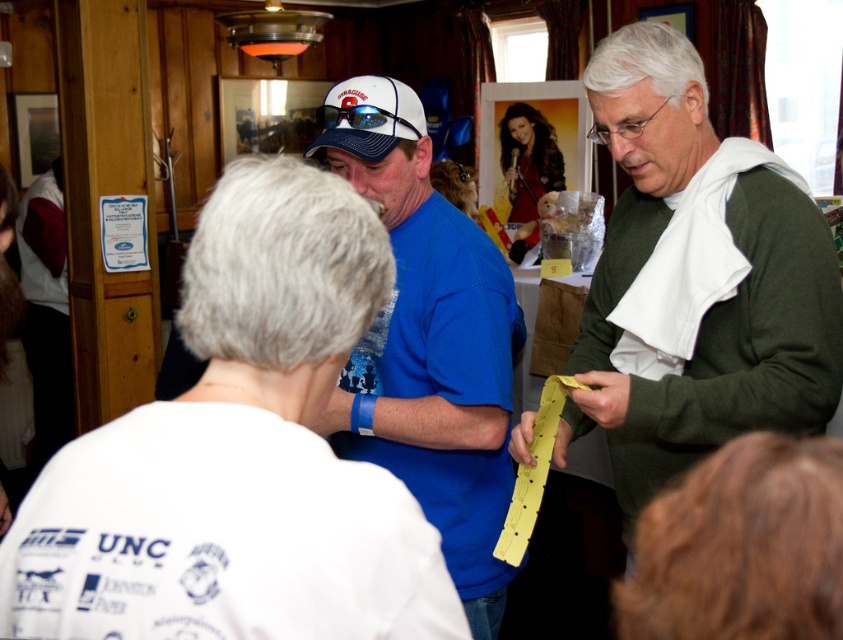
Looking at this image, who is more forward, (470, 240) or (548, 188)?

Point (470, 240) is in front.

Is blue fabric shirt at center above shiny brown hair at upper center?

No, blue fabric shirt at center is not above shiny brown hair at upper center.

Does point (374, 380) come in front of point (538, 189)?

Yes, point (374, 380) is closer to viewer.

You are a GUI agent. You are given a task and a screenshot of the screen. Output one action in this format:
    pyautogui.click(x=<x>, y=<y>)
    Task: Click on the blue fabric shirt at center
    The height and width of the screenshot is (640, 843).
    Given the screenshot: What is the action you would take?
    pyautogui.click(x=428, y=342)

In the scene shown: Is white fabric shirt at upper center taller than blue fabric shirt at center?

In fact, white fabric shirt at upper center may be shorter than blue fabric shirt at center.

Does white fabric shirt at upper center have a greater width compared to blue fabric shirt at center?

No.

Where is `white fabric shirt at upper center`? Image resolution: width=843 pixels, height=640 pixels. white fabric shirt at upper center is located at coordinates (239, 456).

Identify the location of white fabric shirt at upper center. (239, 456).

Based on the photo, who is lower down, green matte sweater at right or blue fabric shirt at center?

blue fabric shirt at center

Is green matte sweater at right in front of blue fabric shirt at center?

Yes, it is in front of blue fabric shirt at center.

Between point (704, 147) and point (364, 412), which one is positioned in front?

Positioned in front is point (364, 412).

Image resolution: width=843 pixels, height=640 pixels. What are the coordinates of `green matte sweater at right` in the screenshot? It's located at (695, 280).